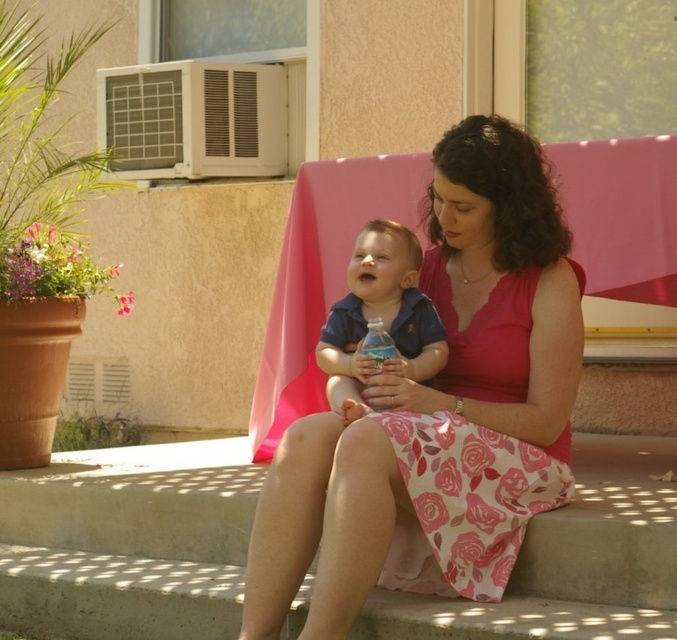
Question: Which point is farther to the camera?

Choices:
 (A) pink floral dress at center
 (B) pink floral fabric dress at center
 (C) matte blue shirt at center
 (D) pink fabric skirt at lower center

Answer: (D)

Question: Is pink floral dress at center positioned before translucent plastic water bottle at center?

Choices:
 (A) no
 (B) yes

Answer: (B)

Question: Does pink fabric skirt at lower center lie in front of pink floral fabric dress at center?

Choices:
 (A) no
 (B) yes

Answer: (A)

Question: Based on their relative distances, which object is farther from the pink floral fabric dress at center?

Choices:
 (A) translucent plastic water bottle at center
 (B) matte blue shirt at center
 (C) pink floral dress at center
 (D) pink fabric skirt at lower center

Answer: (D)

Question: Which of the following is the closest to the observer?

Choices:
 (A) matte blue shirt at center
 (B) translucent plastic water bottle at center
 (C) pink floral dress at center
 (D) pink floral fabric dress at center

Answer: (C)

Question: Is pink floral dress at center positioned before translucent plastic water bottle at center?

Choices:
 (A) yes
 (B) no

Answer: (A)